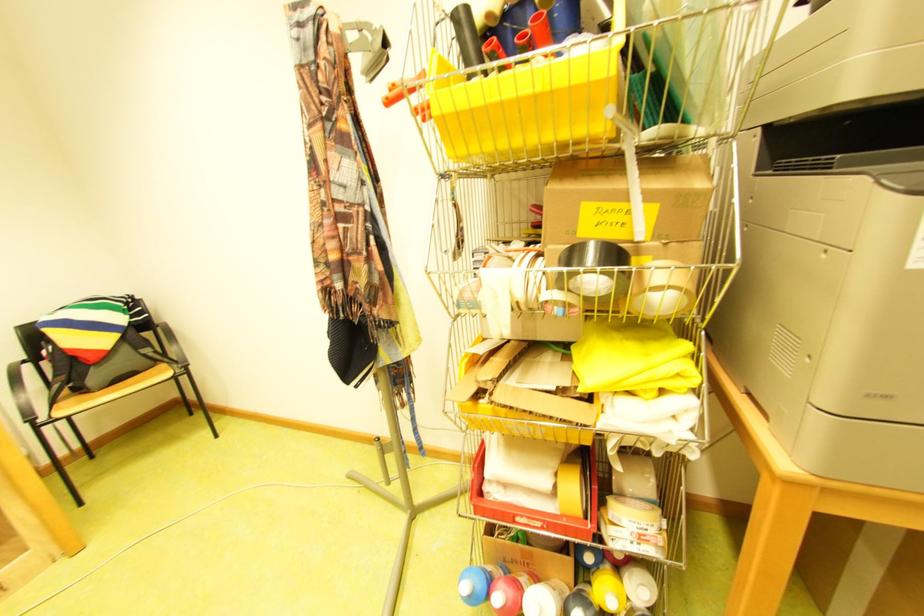
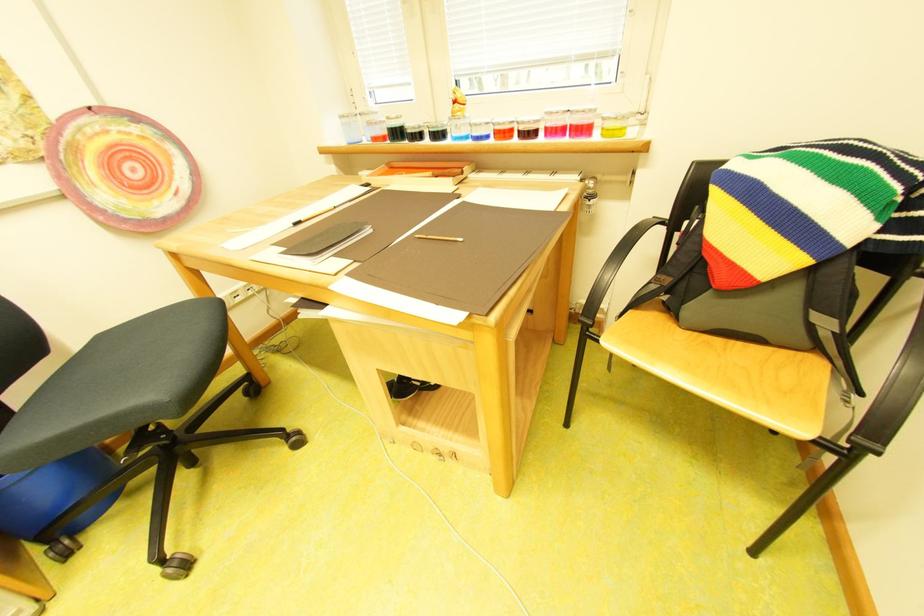
In the second image, find the point that corresponds to (x=174, y=367) in the first image.

(829, 367)